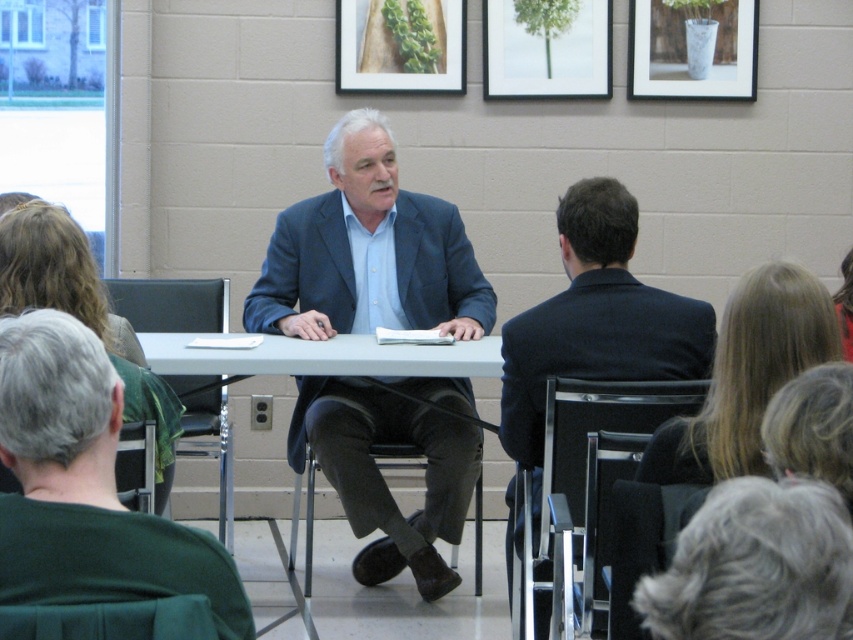
Question: Among these objects, which one is nearest to the camera?

Choices:
 (A) metallic gray chair at center
 (B) white plastic table at center
 (C) white matte picture frame at upper center
 (D) black leather chair at left

Answer: (B)

Question: Considering the real-world distances, which object is closest to the metallic silver chair at lower right?

Choices:
 (A) wooden frame at upper center
 (B) metallic silver vase at upper right
 (C) black leather chair at left

Answer: (C)

Question: Is black leather chair at left smaller than velvet green chair at lower left?

Choices:
 (A) no
 (B) yes

Answer: (A)

Question: Which object is farther from the camera taking this photo?

Choices:
 (A) black leather chair at left
 (B) green fabric chair at lower left

Answer: (A)

Question: Observing the image, what is the correct spatial positioning of white matte picture frame at upper center in reference to velvet green chair at lower left?

Choices:
 (A) below
 (B) above

Answer: (B)

Question: From the image, what is the correct spatial relationship of white plastic table at center in relation to green fabric chair at lower left?

Choices:
 (A) right
 (B) left

Answer: (A)